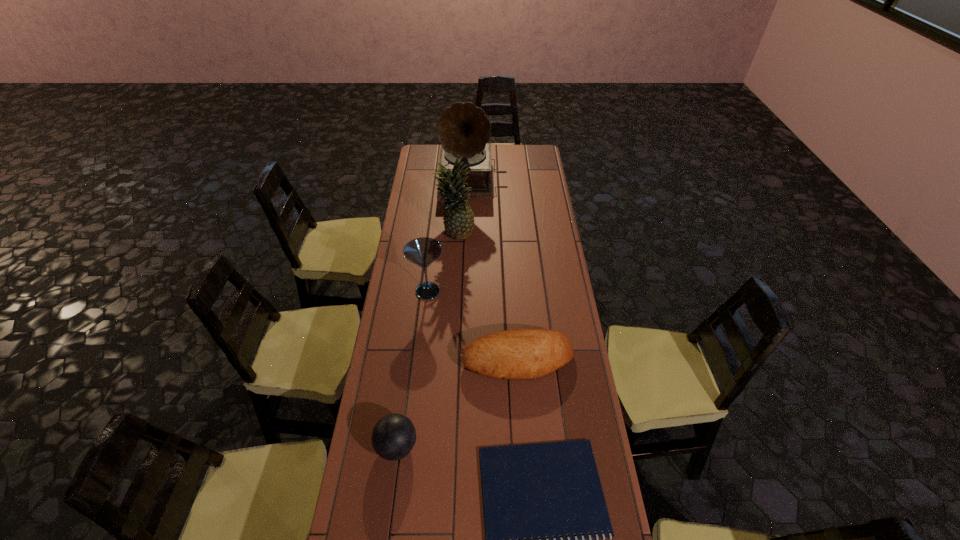
You are a GUI agent. You are given a task and a screenshot of the screen. Output one action in this format:
    pyautogui.click(x=<x>, y=<y>)
    Task: Click on the vacant space at the left edge
    This screenshot has width=960, height=540.
    Given the screenshot: What is the action you would take?
    pyautogui.click(x=384, y=335)

Find the location of a particular element. This screenshot has width=960, height=540. vacant space at the right edge is located at coordinates [x=546, y=168].

This screenshot has width=960, height=540. Find the location of `free spot at the far left corner of the desktop`. free spot at the far left corner of the desktop is located at coordinates (432, 164).

Where is `free point between the bowling ball and the record player`? Image resolution: width=960 pixels, height=540 pixels. free point between the bowling ball and the record player is located at coordinates (435, 314).

This screenshot has height=540, width=960. Find the location of `vacant area between the third nearest object and the farthest object`. vacant area between the third nearest object and the farthest object is located at coordinates (495, 271).

At what (x,y) coordinates should I click in order to perform the action: click on free space that is in between the fourth farthest object and the pineapple. Please return your answer as a coordinate pair (x, y). Looking at the image, I should click on (487, 297).

Find the location of a particular element. The height and width of the screenshot is (540, 960). free spot between the fourth farthest object and the second tallest object is located at coordinates (487, 297).

Locate which object ranks second in proximity to the second shortest object. Please provide its 2D coordinates. Your answer should be formatted as a tuple, i.e. [(x, y)], where the tuple contains the x and y coordinates of a point satisfying the conditions above.

[(394, 435)]

What are the coordinates of `the closest object to the farthest object` in the screenshot? It's located at point(458,218).

Locate an element on the screen. vacant space that satisfies the following two spatial constraints: 1. from the horn of the record player; 2. on the right side of the third nearest object is located at coordinates (468, 360).